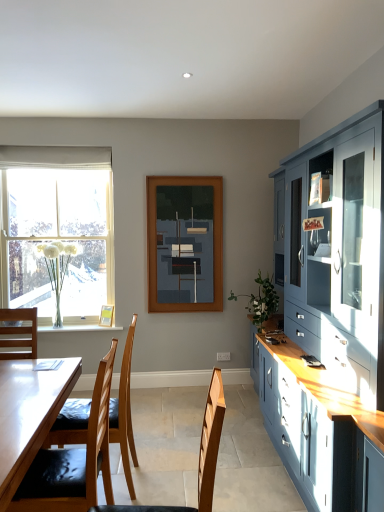
I want to click on blank space to the left of matte yellow picture frame at window, so click(91, 329).